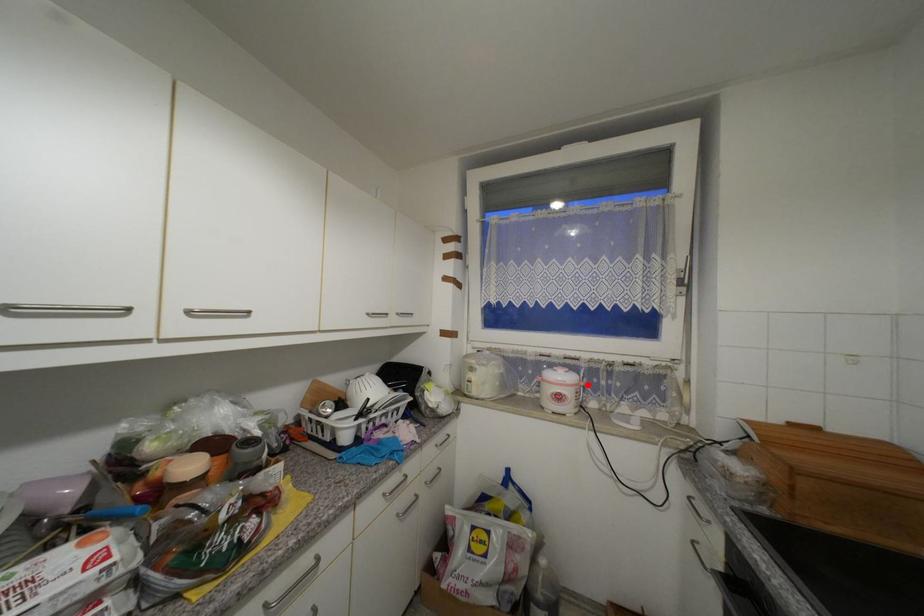
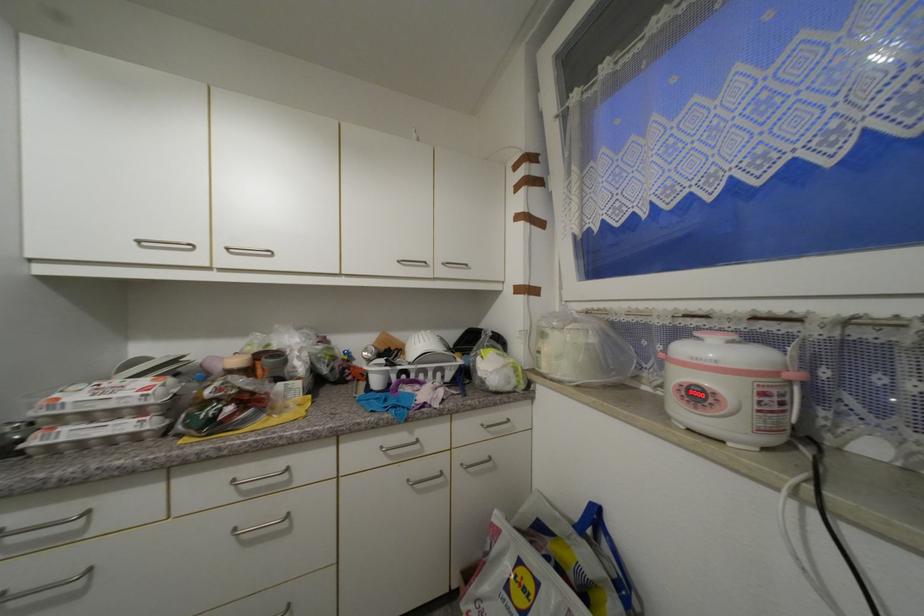
Where in the second image is the point corresponding to the highlighted location from the first image?

(799, 378)